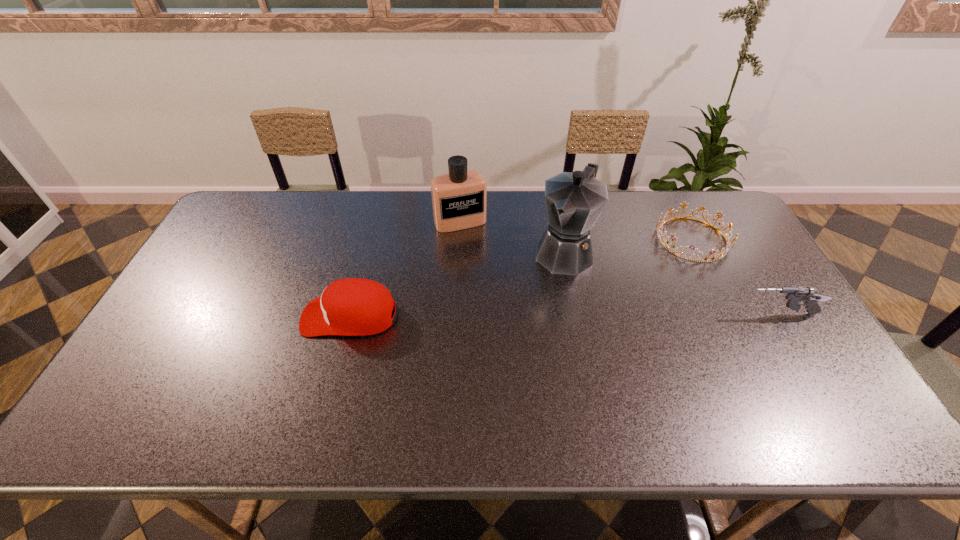
The image size is (960, 540). I want to click on free location located 0.100m at the spout of the tallest object, so click(x=540, y=296).

Locate an element on the screen. vacant region located at the spout of the tallest object is located at coordinates (527, 315).

The image size is (960, 540). What are the coordinates of `tiara that is at the far edge` in the screenshot? It's located at (724, 250).

Find the location of `perfume that is at the far edge`. perfume that is at the far edge is located at coordinates (459, 198).

Image resolution: width=960 pixels, height=540 pixels. Identify the location of coffeepot that is at the far edge. (574, 201).

I want to click on gun situated at the right edge, so click(x=795, y=295).

Find the location of a particular element. tiara located in the right edge section of the desktop is located at coordinates (724, 250).

Where is `object that is at the far right corner`? object that is at the far right corner is located at coordinates (724, 250).

This screenshot has width=960, height=540. In order to click on vacant space at the far edge of the desktop in this screenshot , I will do `click(347, 193)`.

You are a GUI agent. You are given a task and a screenshot of the screen. Output one action in this format:
    pyautogui.click(x=<x>, y=<y>)
    Task: Click on the free space at the near edge of the desktop
    The image size is (960, 540).
    Given the screenshot: What is the action you would take?
    pyautogui.click(x=580, y=392)